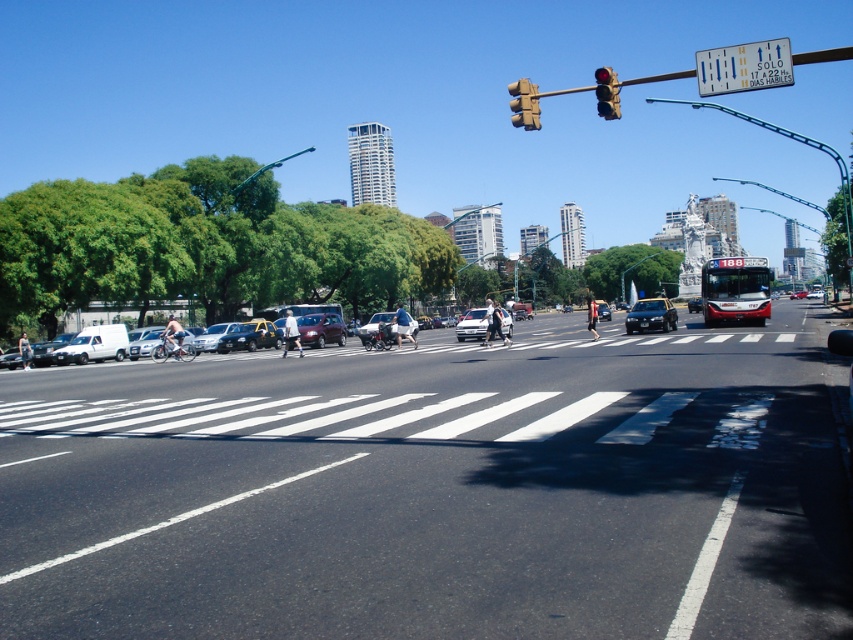
Question: Does red glass traffic light at upper right appear on the left side of white glossy sedan at center?

Choices:
 (A) yes
 (B) no

Answer: (B)

Question: Which point is closer to the camera?

Choices:
 (A) white plastic sign at upper center
 (B) white asphalt road at center
 (C) white glossy sedan at center
 (D) metallic traffic light at upper center

Answer: (B)

Question: Based on their relative distances, which object is farther from the red glass traffic light at upper right?

Choices:
 (A) matte black sedan at center
 (B) white matte van at left
 (C) shiny metallic sedan at center

Answer: (A)

Question: Estimate the real-world distances between objects in this image. Which object is farther from the white asphalt road at center?

Choices:
 (A) shiny silver car at center
 (B) metallic traffic light at upper center
 (C) shiny black sedan at center
 (D) white matte van at left

Answer: (D)

Question: Is white asphalt road at center bigger than matte black sedan at center?

Choices:
 (A) yes
 (B) no

Answer: (A)

Question: Does metallic traffic light at upper center have a larger size compared to silver metallic sedan at center-left?

Choices:
 (A) yes
 (B) no

Answer: (A)